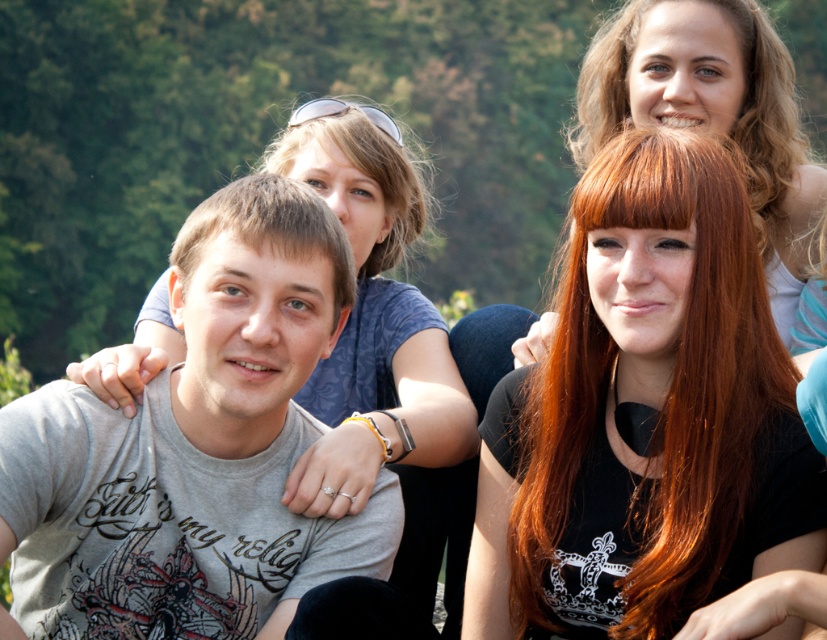
In the scene, you see two people with curly blonde hair at upper right and brown matte hair at center. Which one is positioned higher in the image?

The curly blonde hair at upper right is positioned higher than the brown matte hair at center.

You are standing in a park and see a person with shiny red hair at center. If you want to take a photo of them from where you are standing, will they be in focus if your camera has a depth of field that can clearly capture subjects within 5 meters?

The shiny red hair at center is 5.69 meters away from the viewer. Since the camera can only focus within 5 meters, the subject will be out of focus.